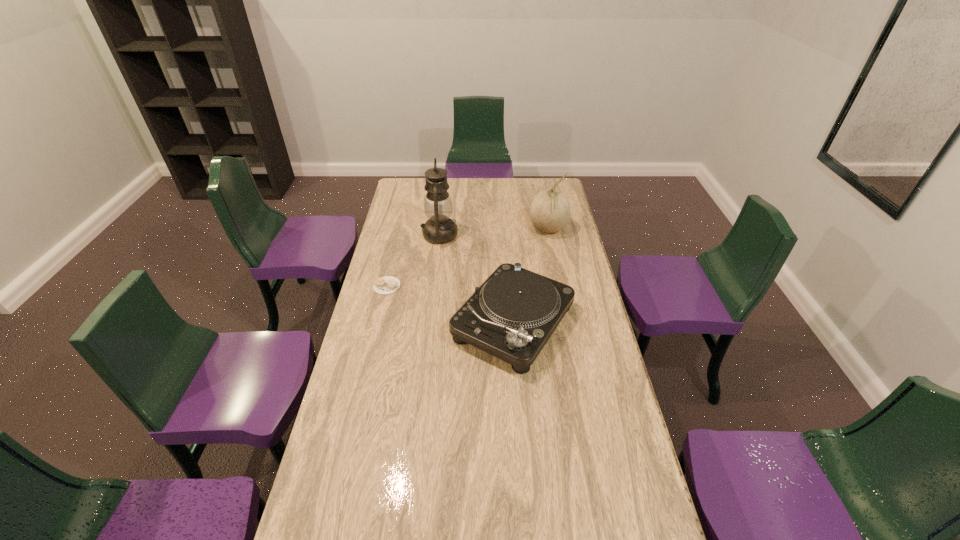
Locate an element on the screen. the tallest object is located at coordinates (439, 228).

Find the location of a particular element. the second tallest object is located at coordinates (549, 212).

Image resolution: width=960 pixels, height=540 pixels. Find the location of `the second shortest object`. the second shortest object is located at coordinates (511, 316).

Identify the location of the leftmost object. (385, 285).

At what (x,y) coordinates should I click in order to perform the action: click on cappuccino. Please return your answer as a coordinate pair (x, y). Looking at the image, I should click on (385, 285).

This screenshot has height=540, width=960. I want to click on free location located 0.250m on the back of the tallest object, so click(x=444, y=195).

This screenshot has height=540, width=960. I want to click on free space located 0.170m on the left of the third shortest object, so click(493, 230).

Find the location of a particular element. This screenshot has width=960, height=540. free space located on the back of the record player is located at coordinates (506, 228).

Locate an element on the screen. Image resolution: width=960 pixels, height=540 pixels. blank space located 0.110m on the front of the shortest object is located at coordinates (380, 315).

Where is `object that is at the left edge`? Image resolution: width=960 pixels, height=540 pixels. object that is at the left edge is located at coordinates (385, 285).